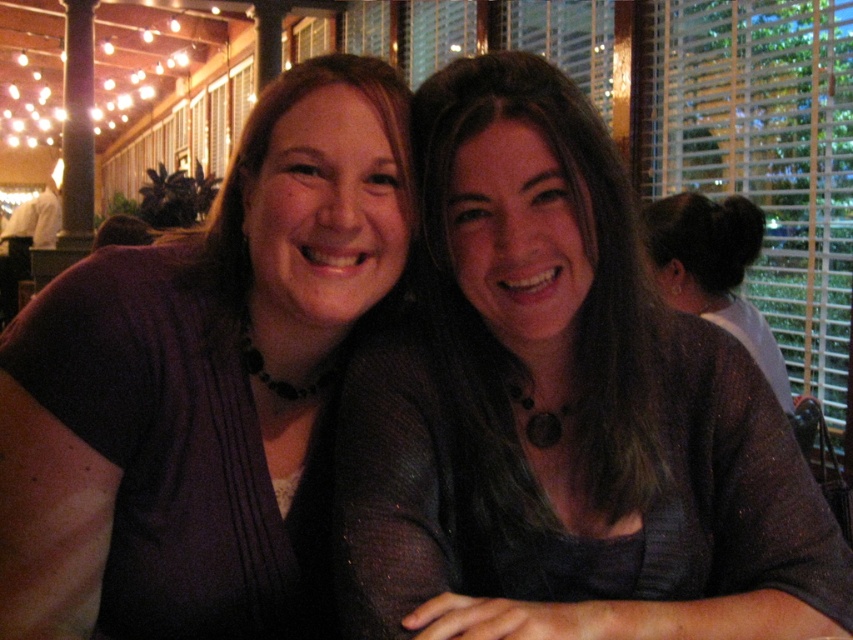
Question: Can you confirm if matte gray sweater at center is bigger than purple fabric shirt at center?

Choices:
 (A) yes
 (B) no

Answer: (A)

Question: Which of the following is the farthest from the observer?

Choices:
 (A) (465, 444)
 (B) (213, 545)

Answer: (A)

Question: Does matte gray sweater at center appear under purple fabric shirt at center?

Choices:
 (A) yes
 (B) no

Answer: (A)

Question: Which object appears farthest from the camera in this image?

Choices:
 (A) purple fabric shirt at center
 (B) matte gray sweater at center

Answer: (A)

Question: Can you confirm if matte gray sweater at center is wider than purple fabric shirt at center?

Choices:
 (A) yes
 (B) no

Answer: (A)